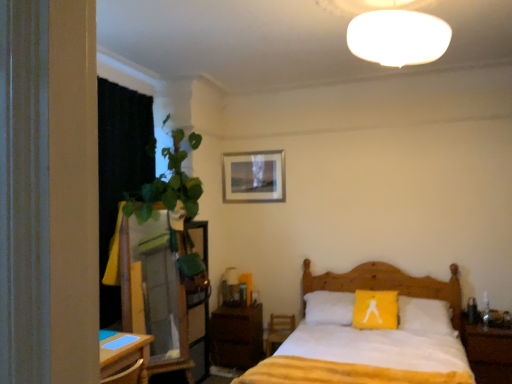
Question: Can you confirm if gold-framed picture at upper center is positioned to the left of black fabric curtain at left?

Choices:
 (A) yes
 (B) no

Answer: (B)

Question: Does gold-framed picture at upper center lie behind black fabric curtain at left?

Choices:
 (A) yes
 (B) no

Answer: (A)

Question: Considering the relative sizes of gold-framed picture at upper center and black fabric curtain at left in the image provided, is gold-framed picture at upper center taller than black fabric curtain at left?

Choices:
 (A) no
 (B) yes

Answer: (A)

Question: From the image's perspective, does gold-framed picture at upper center appear higher than black fabric curtain at left?

Choices:
 (A) yes
 (B) no

Answer: (A)

Question: Does gold-framed picture at upper center have a lesser width compared to black fabric curtain at left?

Choices:
 (A) yes
 (B) no

Answer: (A)

Question: Can you confirm if gold-framed picture at upper center is shorter than black fabric curtain at left?

Choices:
 (A) yes
 (B) no

Answer: (A)

Question: Is white soft bedsheet at lower center at the back of wooden nightstand at right, arranged as the 1th nightstand when viewed from the front?

Choices:
 (A) yes
 (B) no

Answer: (B)

Question: Considering the relative sizes of wooden nightstand at right, arranged as the 1th nightstand when viewed from the front, and white soft bedsheet at lower center in the image provided, is wooden nightstand at right, arranged as the 1th nightstand when viewed from the front, taller than white soft bedsheet at lower center?

Choices:
 (A) yes
 (B) no

Answer: (A)

Question: Is wooden nightstand at right, which appears as the 2th nightstand when viewed from the left, bigger than white soft bedsheet at lower center?

Choices:
 (A) no
 (B) yes

Answer: (B)

Question: Considering the relative positions of wooden nightstand at right, arranged as the 1th nightstand when viewed from the front, and white soft bedsheet at lower center in the image provided, is wooden nightstand at right, arranged as the 1th nightstand when viewed from the front, to the right of white soft bedsheet at lower center from the viewer's perspective?

Choices:
 (A) no
 (B) yes

Answer: (B)

Question: Is wooden nightstand at right, arranged as the 1th nightstand when viewed from the front, with white soft bedsheet at lower center?

Choices:
 (A) yes
 (B) no

Answer: (B)

Question: Would you say wooden nightstand at right, the second nightstand in the back-to-front sequence, contains white soft bedsheet at lower center?

Choices:
 (A) yes
 (B) no

Answer: (B)

Question: Is matte glass table lamp at center aimed at wooden dresser at left?

Choices:
 (A) no
 (B) yes

Answer: (B)